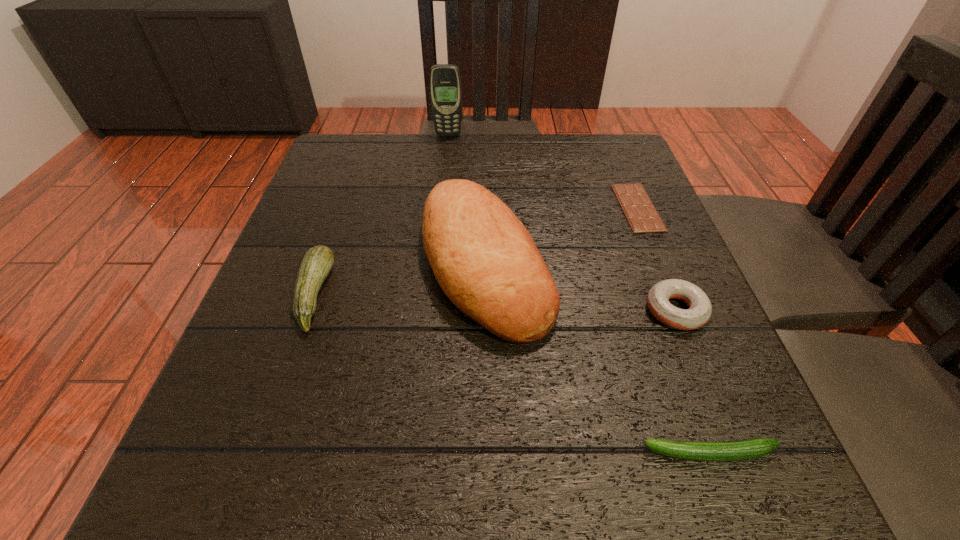
At what (x,y) coordinates should I click in order to perform the action: click on object situated at the left edge. Please return your answer as a coordinate pair (x, y). Image resolution: width=960 pixels, height=540 pixels. Looking at the image, I should click on (318, 261).

Identify the location of doughnut located in the right edge section of the desktop. (700, 308).

Identify the location of zucchini positioned at the right edge. (752, 448).

Where is `chocolate bar located in the right edge section of the desktop`? The height and width of the screenshot is (540, 960). chocolate bar located in the right edge section of the desktop is located at coordinates (642, 216).

Identify the location of object that is at the far right corner. (642, 216).

Where is `object situated at the near right corner`? This screenshot has width=960, height=540. object situated at the near right corner is located at coordinates (752, 448).

In the image, there is a desktop. Where is `vacant space at the far edge`? This screenshot has height=540, width=960. vacant space at the far edge is located at coordinates tap(525, 164).

I want to click on free space at the near edge, so [629, 496].

You are a GUI agent. You are given a task and a screenshot of the screen. Output one action in this format:
    pyautogui.click(x=<x>, y=<y>)
    Task: Click on the blank space at the left edge
    The height and width of the screenshot is (540, 960).
    Given the screenshot: What is the action you would take?
    pyautogui.click(x=356, y=190)

The width and height of the screenshot is (960, 540). In order to click on vacant space at the right edge of the desktop in this screenshot , I will do `click(636, 286)`.